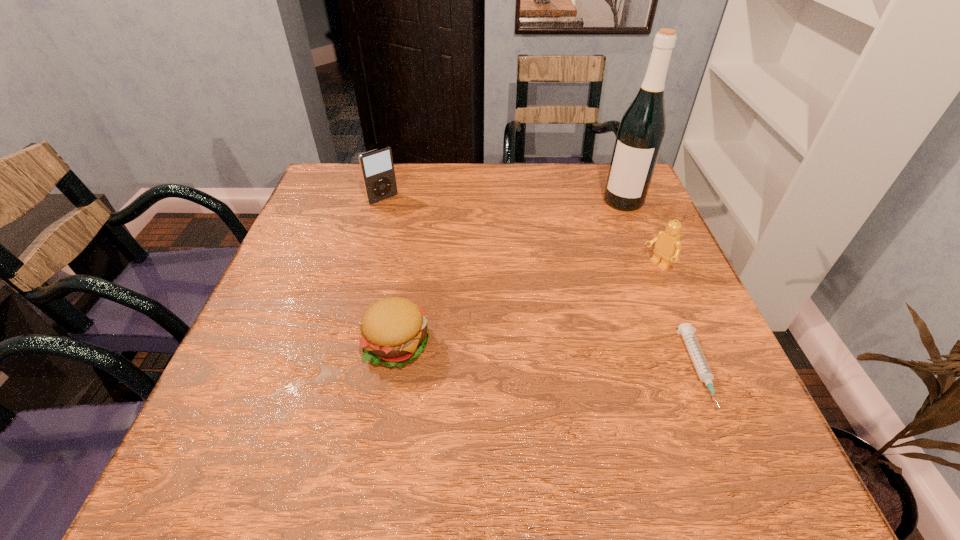
You are a GUI agent. You are given a task and a screenshot of the screen. Output one action in this format:
    pyautogui.click(x=<x>, y=<y>)
    Task: Click on the fourth tallest object
    
    Given the screenshot: What is the action you would take?
    pyautogui.click(x=394, y=331)

Find the location of a particular element. This screenshot has height=540, width=960. syringe is located at coordinates (x=686, y=330).

Where is `iPod`? This screenshot has width=960, height=540. iPod is located at coordinates (377, 168).

Find the location of a particular element. Image resolution: width=960 pixels, height=540 pixels. the third tallest object is located at coordinates point(668,245).

At what (x,y) coordinates should I click in order to perform the action: click on the third nearest object. Please return your answer as a coordinate pair (x, y). Image resolution: width=960 pixels, height=540 pixels. Looking at the image, I should click on (668, 245).

Image resolution: width=960 pixels, height=540 pixels. I want to click on the tallest object, so click(640, 135).

The width and height of the screenshot is (960, 540). What are the coordinates of `free space located on the back of the fourth tallest object` in the screenshot? It's located at (410, 265).

Locate an element on the screen. This screenshot has width=960, height=540. vacant area located 0.380m on the front-facing side of the iPod is located at coordinates [x=471, y=285].

This screenshot has width=960, height=540. Find the location of `vacant position located on the front-facing side of the iPod`. vacant position located on the front-facing side of the iPod is located at coordinates (424, 238).

The height and width of the screenshot is (540, 960). In order to click on vacant space located on the front-facing side of the iPod in this screenshot , I will do `click(404, 219)`.